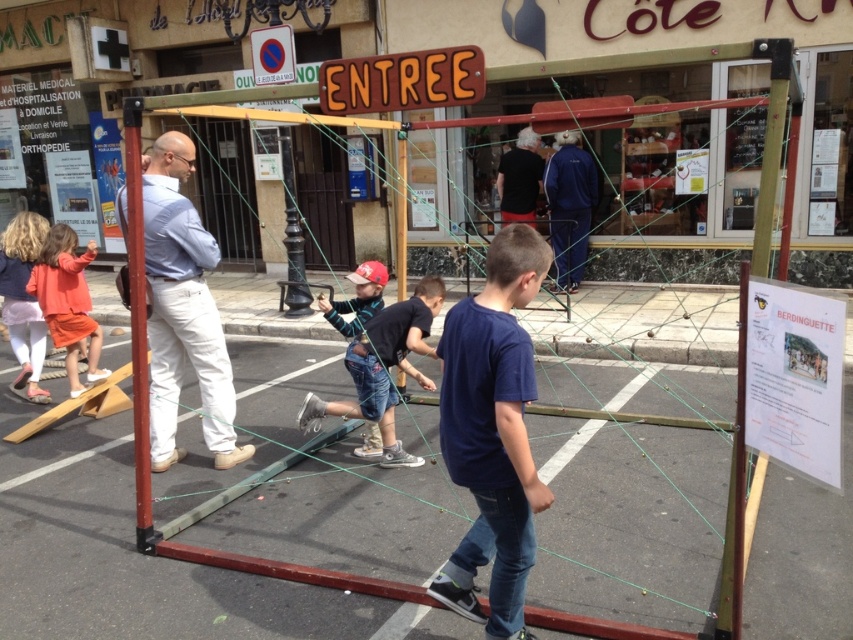
Question: Which object is farther from the camera taking this photo?

Choices:
 (A) orange cotton dress at left
 (B) light blue shirt at center

Answer: (A)

Question: Does denim jeans at center come behind black cotton shirt at center?

Choices:
 (A) yes
 (B) no

Answer: (B)

Question: Can you confirm if light blue shirt at center is bigger than blue track suit at center?

Choices:
 (A) yes
 (B) no

Answer: (A)

Question: Which point is farther to the camera?

Choices:
 (A) dark blue t-shirt at center
 (B) light blue shirt at center
 (C) black cotton shirt at center
 (D) blue track suit at center

Answer: (C)

Question: Which object is closer to the camera taking this photo?

Choices:
 (A) blue track suit at center
 (B) black cotton shirt at center

Answer: (A)

Question: Can you confirm if light blue shirt at center is positioned above denim jeans at center?

Choices:
 (A) yes
 (B) no

Answer: (A)